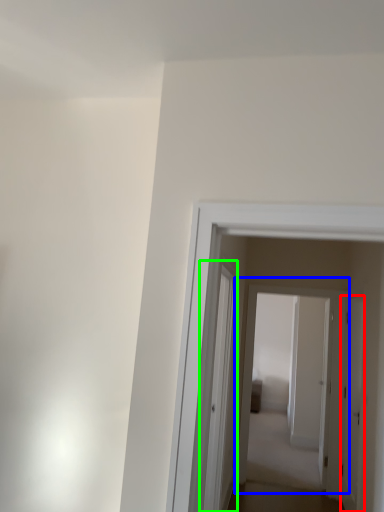
Question: Which is farther away from door (highlighted by a red box)? door (highlighted by a blue box) or glass door (highlighted by a green box)?

Choices:
 (A) door
 (B) glass door

Answer: (B)